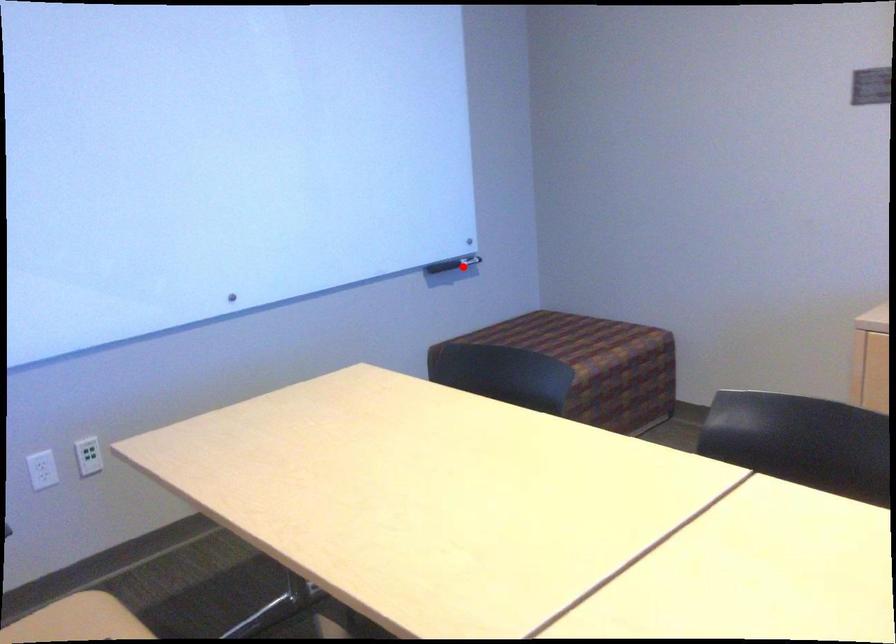
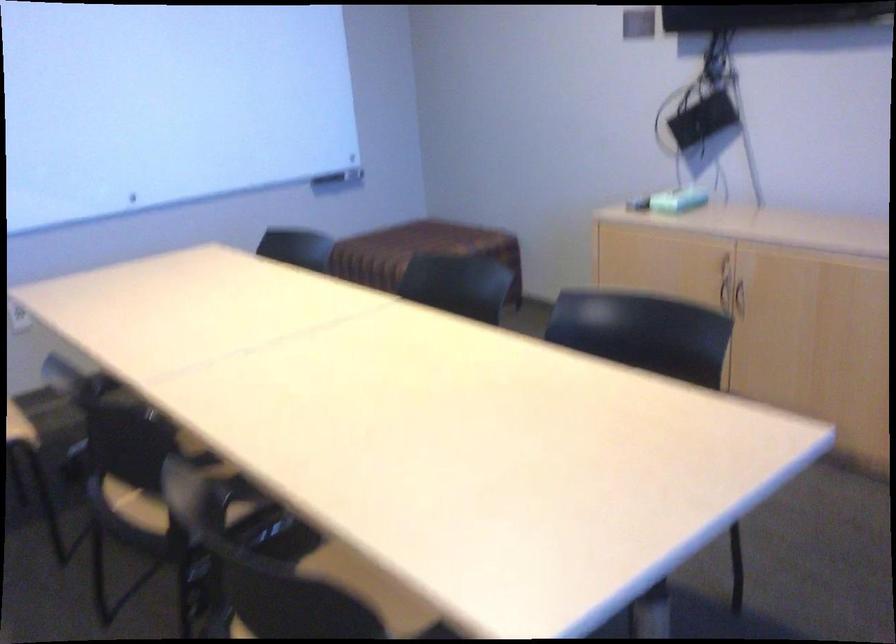
Question: I am providing you with two images of the same scene from different viewpoints. Image1 has a red point marked. In image2, the corresponding 3D location appears at what relative position? Reply with the corresponding letter.

Choices:
 (A) Closer
 (B) Farther

Answer: (B)